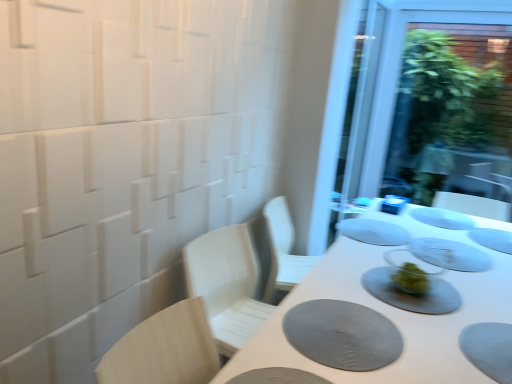
Identify the location of free space that is in between white matte plate at center, the 5th tableware viewed from the front, and clear glass plate at center, the fifth tableware positioned from the back. The width and height of the screenshot is (512, 384). (424, 230).